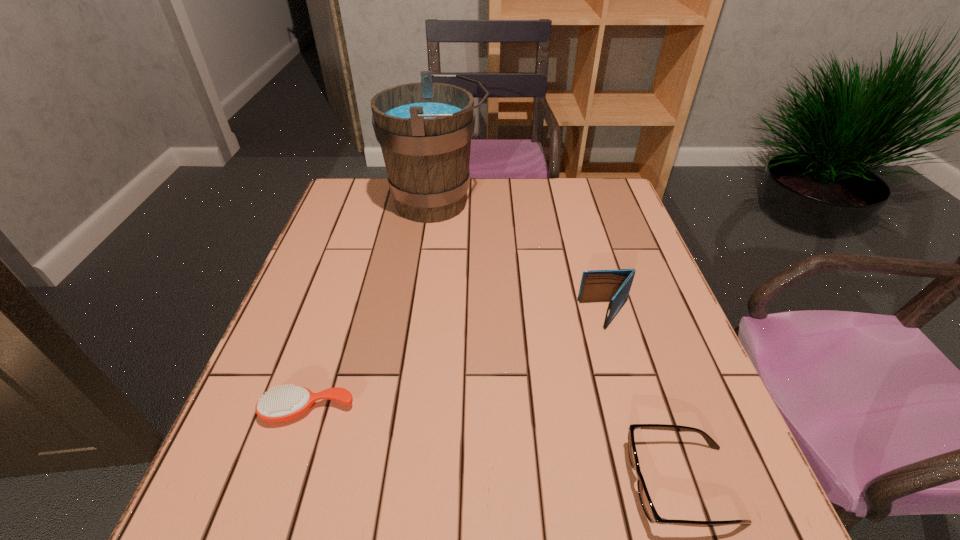
Image resolution: width=960 pixels, height=540 pixels. What are the coordinates of `wallet located at the right edge` in the screenshot? It's located at (614, 286).

Locate an element on the screen. The width and height of the screenshot is (960, 540). spectacles that is positioned at the right edge is located at coordinates (646, 502).

You are a GUI agent. You are given a task and a screenshot of the screen. Output one action in this format:
    pyautogui.click(x=<x>, y=<y>)
    Task: Click on the object that is at the far left corner
    The width and height of the screenshot is (960, 540).
    Given the screenshot: What is the action you would take?
    pyautogui.click(x=424, y=129)

Locate an element on the screen. This screenshot has height=540, width=960. object present at the near right corner is located at coordinates coord(646,502).

At what (x,y) coordinates should I click in order to perform the action: click on free space at the far edge of the desktop. Please return your answer as a coordinate pair (x, y). Looking at the image, I should click on (530, 193).

Identify the location of free space at the near edge of the desktop. coord(528,487).

At what (x,y) coordinates should I click in order to perform the action: click on blank area at the left edge. Please return your answer as a coordinate pair (x, y). Looking at the image, I should click on (349, 333).

What are the coordinates of `vacant space at the right edge` in the screenshot? It's located at (600, 237).

This screenshot has width=960, height=540. In order to click on free region at the far left corner of the desktop in this screenshot , I will do `click(350, 220)`.

The image size is (960, 540). In order to click on free space at the far right corner of the desktop in this screenshot , I will do `click(573, 208)`.